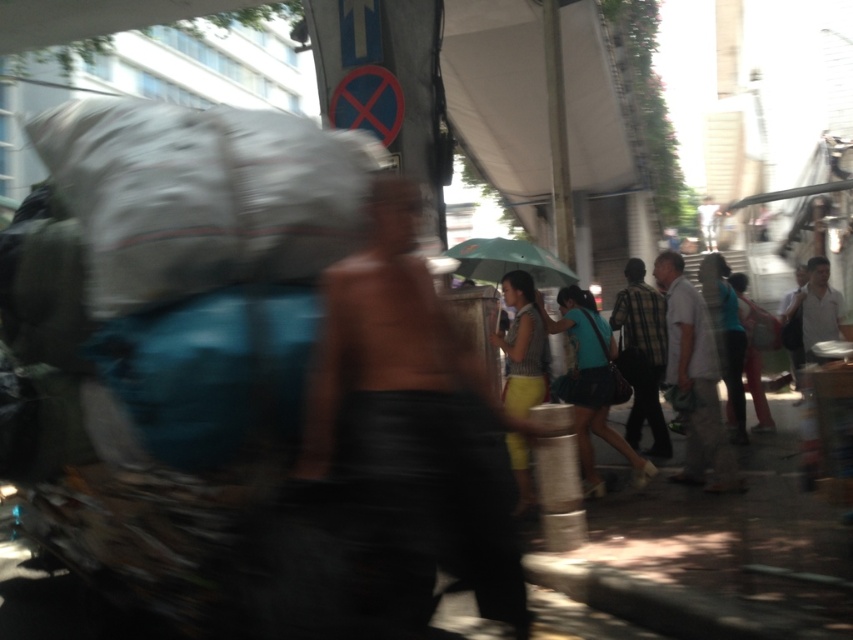
Question: Is gray fabric sack at center to the left of blue denim skirt at center from the viewer's perspective?

Choices:
 (A) yes
 (B) no

Answer: (A)

Question: Is light blue shirt at center below striped fabric shirt at center?

Choices:
 (A) no
 (B) yes

Answer: (B)

Question: Based on their relative distances, which object is nearer to the green matte umbrella at center?

Choices:
 (A) striped fabric shirt at center
 (B) light blue shirt at center

Answer: (A)

Question: Which point appears farthest from the camera in this image?

Choices:
 (A) (589, 417)
 (B) (561, 276)
 (C) (292, 385)
 (D) (711, 387)

Answer: (B)

Question: Which point is farther from the camera taking this photo?

Choices:
 (A) (682, 342)
 (B) (659, 307)
 (C) (627, 385)

Answer: (B)

Question: Can you confirm if gray fabric sack at center is positioned above blue denim skirt at center?

Choices:
 (A) yes
 (B) no

Answer: (A)